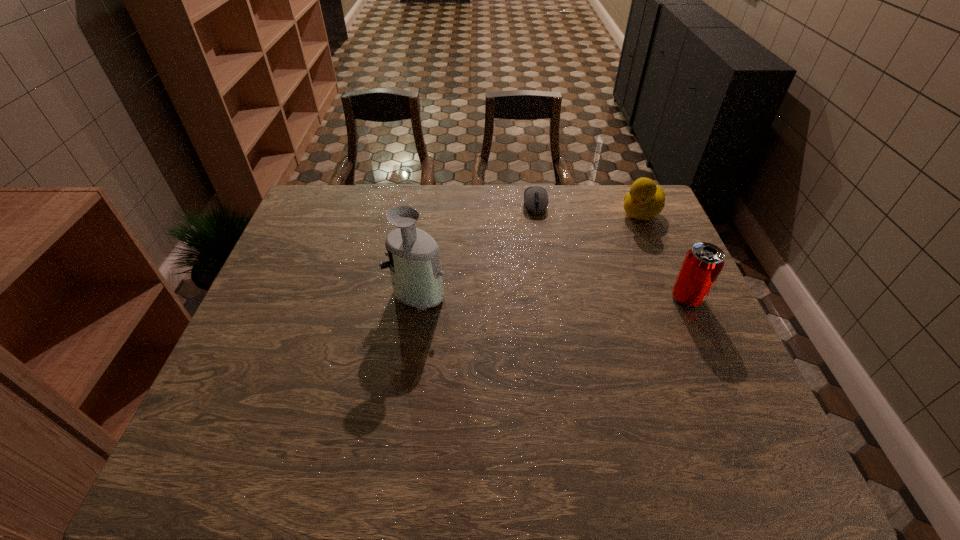
The image size is (960, 540). I want to click on free space at the near edge, so click(346, 415).

In the image, there is a desktop. Where is `vacant space at the left edge`? This screenshot has width=960, height=540. vacant space at the left edge is located at coordinates (307, 278).

At what (x,y) coordinates should I click in order to perform the action: click on free region at the right edge of the desktop. Please return your answer as a coordinate pair (x, y). Looking at the image, I should click on (702, 321).

Where is `vacant space at the far left corner`? vacant space at the far left corner is located at coordinates (357, 192).

Locate an element on the screen. The width and height of the screenshot is (960, 540). vacant space at the far right corner of the desktop is located at coordinates (612, 207).

In the image, there is a desktop. At what (x,y) coordinates should I click in order to perform the action: click on free region at the near right corner. Please return your answer as a coordinate pair (x, y). Looking at the image, I should click on (687, 416).

Find the location of a particular element. The height and width of the screenshot is (540, 960). free space between the soda can and the shortest object is located at coordinates tap(612, 251).

Find the location of a particular element. The width and height of the screenshot is (960, 540). vacant space that's between the second object from left to right and the juicer is located at coordinates (476, 248).

Locate an element on the screen. The width and height of the screenshot is (960, 540). free space that is in between the third tallest object and the third shortest object is located at coordinates (664, 255).

Image resolution: width=960 pixels, height=540 pixels. Find the location of `vacant space that's between the second tallest object and the computer equipment`. vacant space that's between the second tallest object and the computer equipment is located at coordinates (612, 251).